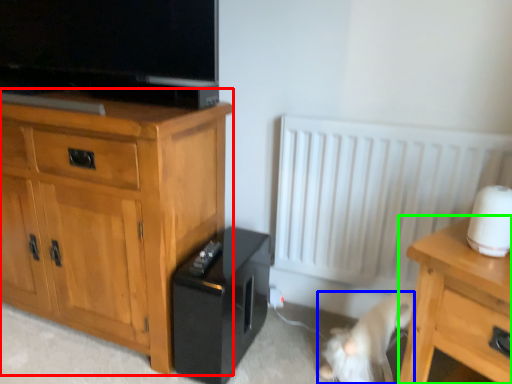
Question: Which is nearer to the chest of drawers (highlighted by a red box)? animal (highlighted by a blue box) or nightstand (highlighted by a green box).

Choices:
 (A) animal
 (B) nightstand

Answer: (A)